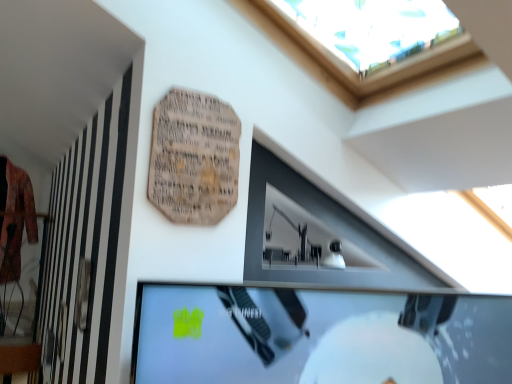
Where is `matte black monitor at lower center`? Image resolution: width=512 pixels, height=384 pixels. matte black monitor at lower center is located at coordinates (318, 336).

The width and height of the screenshot is (512, 384). What do you see at coordinates (318, 336) in the screenshot?
I see `matte black monitor at lower center` at bounding box center [318, 336].

Where is `matte black monitor at lower center`? The height and width of the screenshot is (384, 512). matte black monitor at lower center is located at coordinates [318, 336].